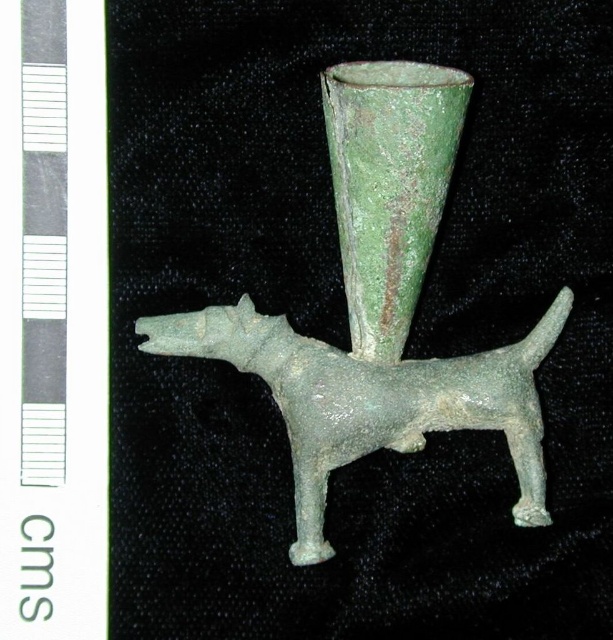
Is green patinated metal dog at center above green patinated glass vase at center?

No, green patinated metal dog at center is not above green patinated glass vase at center.

The image size is (613, 640). What do you see at coordinates (371, 400) in the screenshot?
I see `green patinated metal dog at center` at bounding box center [371, 400].

Image resolution: width=613 pixels, height=640 pixels. I want to click on green patinated metal dog at center, so pyautogui.click(x=371, y=400).